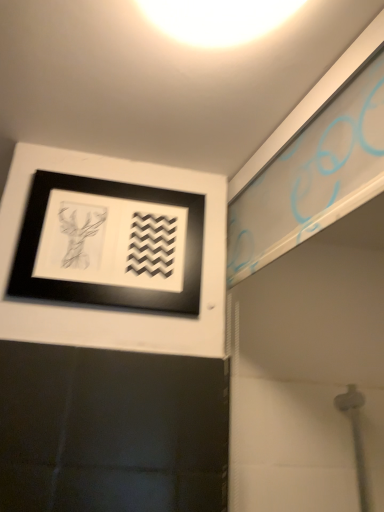
Question: Should I look upward or downward to see black matte picture frame at upper left?

Choices:
 (A) up
 (B) down

Answer: (A)

Question: Considering the relative sizes of white glossy light at upper center and black matte picture frame at upper left in the image provided, is white glossy light at upper center taller than black matte picture frame at upper left?

Choices:
 (A) no
 (B) yes

Answer: (A)

Question: Is white glossy light at upper center looking in the opposite direction of black matte picture frame at upper left?

Choices:
 (A) yes
 (B) no

Answer: (B)

Question: Is white glossy light at upper center shorter than black matte picture frame at upper left?

Choices:
 (A) yes
 (B) no

Answer: (A)

Question: From a real-world perspective, is white glossy light at upper center on black matte picture frame at upper left?

Choices:
 (A) no
 (B) yes

Answer: (B)

Question: Is white glossy light at upper center beside black matte picture frame at upper left?

Choices:
 (A) no
 (B) yes

Answer: (A)

Question: Does white glossy light at upper center have a larger size compared to black matte picture frame at upper left?

Choices:
 (A) no
 (B) yes

Answer: (B)

Question: From a real-world perspective, is black matte picture frame at upper left located beneath white glossy light at upper center?

Choices:
 (A) yes
 (B) no

Answer: (A)

Question: Could you tell me if black matte picture frame at upper left is turned towards white glossy light at upper center?

Choices:
 (A) yes
 (B) no

Answer: (A)

Question: Does black matte picture frame at upper left have a smaller size compared to white glossy light at upper center?

Choices:
 (A) yes
 (B) no

Answer: (A)

Question: Does black matte picture frame at upper left lie behind white glossy light at upper center?

Choices:
 (A) yes
 (B) no

Answer: (A)

Question: Is black matte picture frame at upper left oriented away from white glossy light at upper center?

Choices:
 (A) yes
 (B) no

Answer: (B)

Question: Is black matte picture frame at upper left closer to the viewer compared to white glossy light at upper center?

Choices:
 (A) no
 (B) yes

Answer: (A)

Question: Looking at the image, does black matte picture frame at upper left seem bigger or smaller compared to white glossy light at upper center?

Choices:
 (A) small
 (B) big

Answer: (A)